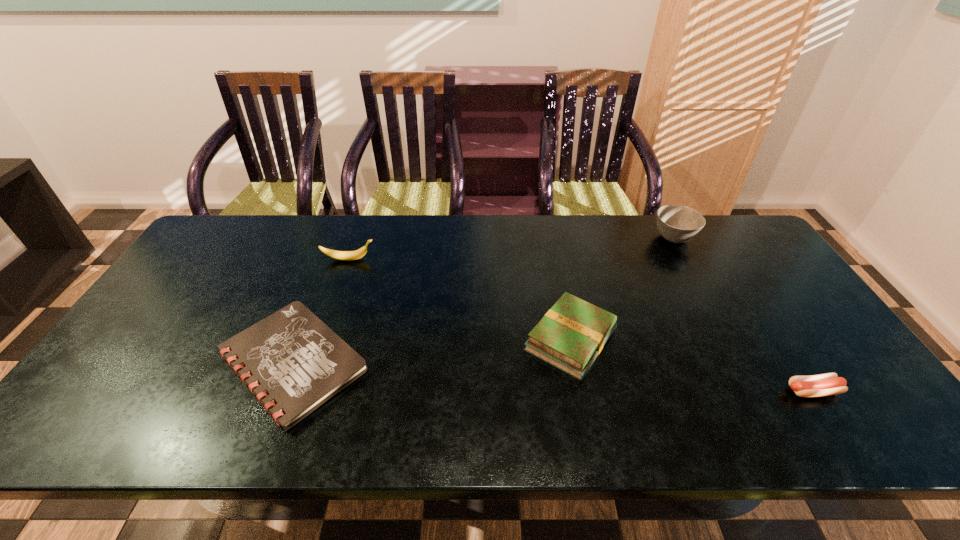
Image resolution: width=960 pixels, height=540 pixels. What are the coordinates of `object that is the fourth closest to the banana` in the screenshot? It's located at (827, 384).

This screenshot has width=960, height=540. I want to click on the second closest object to the sausage, so click(676, 223).

Locate an element on the screen. free space in the image that satisfies the following two spatial constraints: 1. on the back side of the sausage; 2. at the stem of the fourth nearest object is located at coordinates (728, 259).

The image size is (960, 540). What are the coordinates of `vacant region that satisfies the following two spatial constraints: 1. on the front side of the notebook; 2. on the left side of the sausage` in the screenshot? It's located at (281, 391).

Find the location of `vacant space that satisfies the following two spatial constraints: 1. on the back side of the bowl; 2. on the right side of the shortest object`. vacant space that satisfies the following two spatial constraints: 1. on the back side of the bowl; 2. on the right side of the shortest object is located at coordinates (341, 238).

Where is `vacant space that satisfies the following two spatial constraints: 1. at the stem of the sausage; 2. on the left side of the fourth nearest object`? Image resolution: width=960 pixels, height=540 pixels. vacant space that satisfies the following two spatial constraints: 1. at the stem of the sausage; 2. on the left side of the fourth nearest object is located at coordinates (303, 391).